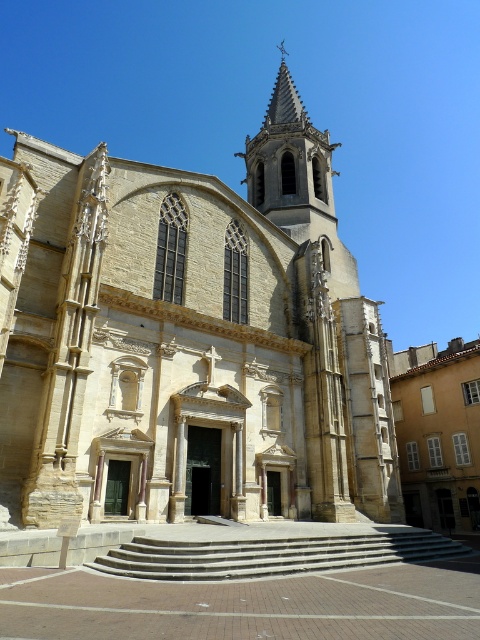
Between beige stone church at center and gray concrete stairs at center, which one has more height?

beige stone church at center

Can you confirm if beige stone church at center is positioned to the left of gray concrete stairs at center?

Yes, beige stone church at center is to the left of gray concrete stairs at center.

Identify the location of beige stone church at center. (188, 339).